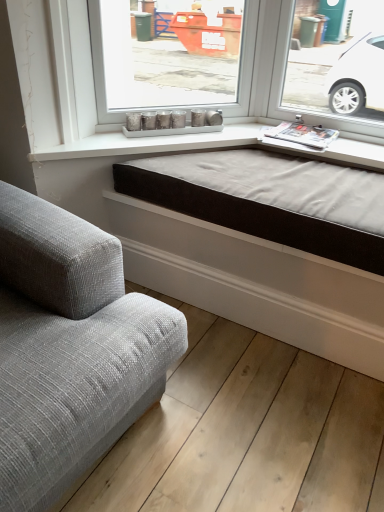
Image resolution: width=384 pixels, height=512 pixels. Describe the element at coordinates (69, 349) in the screenshot. I see `textured gray fabric couch at lower left` at that location.

Measure the distance between point (6, 355) and camera.

Point (6, 355) and camera are 3.47 feet apart.

You are a GUI agent. You are given a task and a screenshot of the screen. Output one action in this format:
    pyautogui.click(x=<x>, y=<y>)
    Task: Click on the textured gray fabric couch at lower left
    
    Given the screenshot: What is the action you would take?
    pyautogui.click(x=69, y=349)

What do you see at coordinates (270, 199) in the screenshot?
I see `brown fabric bed frame at center` at bounding box center [270, 199].

The width and height of the screenshot is (384, 512). I want to click on brown fabric bed frame at center, so click(x=270, y=199).

Where is `textured gray fabric couch at lower left`? This screenshot has width=384, height=512. textured gray fabric couch at lower left is located at coordinates (69, 349).

Considering the relative positions of brown fabric bed frame at center and textured gray fabric couch at lower left in the image provided, is brown fabric bed frame at center to the right of textured gray fabric couch at lower left from the viewer's perspective?

Yes.

Which is in front, brown fabric bed frame at center or textured gray fabric couch at lower left?

textured gray fabric couch at lower left is in front.

Is point (243, 192) closer or farther from the camera than point (131, 368)?

Point (243, 192) is positioned farther from the camera compared to point (131, 368).

Based on the photo, from the image's perspective, would you say brown fabric bed frame at center is shown under textured gray fabric couch at lower left?

No, from the image's perspective, brown fabric bed frame at center is not below textured gray fabric couch at lower left.

From a real-world perspective, is brown fabric bed frame at center above or below textured gray fabric couch at lower left?

brown fabric bed frame at center is situated higher than textured gray fabric couch at lower left in the real world.

Can you confirm if brown fabric bed frame at center is wider than textured gray fabric couch at lower left?

In fact, brown fabric bed frame at center might be narrower than textured gray fabric couch at lower left.

Between brown fabric bed frame at center and textured gray fabric couch at lower left, which one has less height?

brown fabric bed frame at center.

Between brown fabric bed frame at center and textured gray fabric couch at lower left, which one has smaller size?

brown fabric bed frame at center.

Is brown fabric bed frame at center surrounding textured gray fabric couch at lower left?

No, brown fabric bed frame at center does not contain textured gray fabric couch at lower left.

Is brown fabric bed frame at center next to textured gray fabric couch at lower left and touching it?

No, brown fabric bed frame at center is not next to textured gray fabric couch at lower left.

Does brown fabric bed frame at center turn towards textured gray fabric couch at lower left?

Yes.

Can you tell me how much brown fabric bed frame at center and textured gray fabric couch at lower left differ in facing direction?

They differ by 85.1 degrees in their facing directions.

Where is `bed frame that is above the textured gray fabric couch at lower left (from the image's perspective)`? Image resolution: width=384 pixels, height=512 pixels. bed frame that is above the textured gray fabric couch at lower left (from the image's perspective) is located at coordinates (270, 199).

Can you confirm if textured gray fabric couch at lower left is positioned to the right of brown fabric bed frame at center?

No.

Is textured gray fabric couch at lower left positioned in front of brown fabric bed frame at center?

Yes, it is in front of brown fabric bed frame at center.

Is point (81, 408) positioned behind point (215, 181)?

No, it is in front of (215, 181).

From the image's perspective, is textured gray fabric couch at lower left located beneath brown fabric bed frame at center?

Yes, from the image's perspective, textured gray fabric couch at lower left is below brown fabric bed frame at center.

From a real-world perspective, is textured gray fabric couch at lower left physically below brown fabric bed frame at center?

Yes.

Considering the sizes of objects textured gray fabric couch at lower left and brown fabric bed frame at center in the image provided, who is wider, textured gray fabric couch at lower left or brown fabric bed frame at center?

textured gray fabric couch at lower left is wider.

Can you confirm if textured gray fabric couch at lower left is shorter than brown fabric bed frame at center?

In fact, textured gray fabric couch at lower left may be taller than brown fabric bed frame at center.

Does textured gray fabric couch at lower left have a larger size compared to brown fabric bed frame at center?

Indeed, textured gray fabric couch at lower left has a larger size compared to brown fabric bed frame at center.

Is brown fabric bed frame at center a part of textured gray fabric couch at lower left?

No, brown fabric bed frame at center is not a part of textured gray fabric couch at lower left.

Is textured gray fabric couch at lower left positioned far away from brown fabric bed frame at center?

textured gray fabric couch at lower left is near brown fabric bed frame at center, not far away.

Is brown fabric bed frame at center at the back of textured gray fabric couch at lower left?

textured gray fabric couch at lower left does not have its back to brown fabric bed frame at center.

How different are the orientations of textured gray fabric couch at lower left and brown fabric bed frame at center in degrees?

85.1 degrees separate the facing orientations of textured gray fabric couch at lower left and brown fabric bed frame at center.

The image size is (384, 512). In order to click on studio couch that is on the left side of brown fabric bed frame at center in this screenshot , I will do `click(69, 349)`.

Locate an element on the screen. studio couch that is below the brown fabric bed frame at center (from the image's perspective) is located at coordinates [69, 349].

At what (x,y) coordinates should I click in order to perform the action: click on bed frame behind the textured gray fabric couch at lower left. Please return your answer as a coordinate pair (x, y). The image size is (384, 512). Looking at the image, I should click on (270, 199).